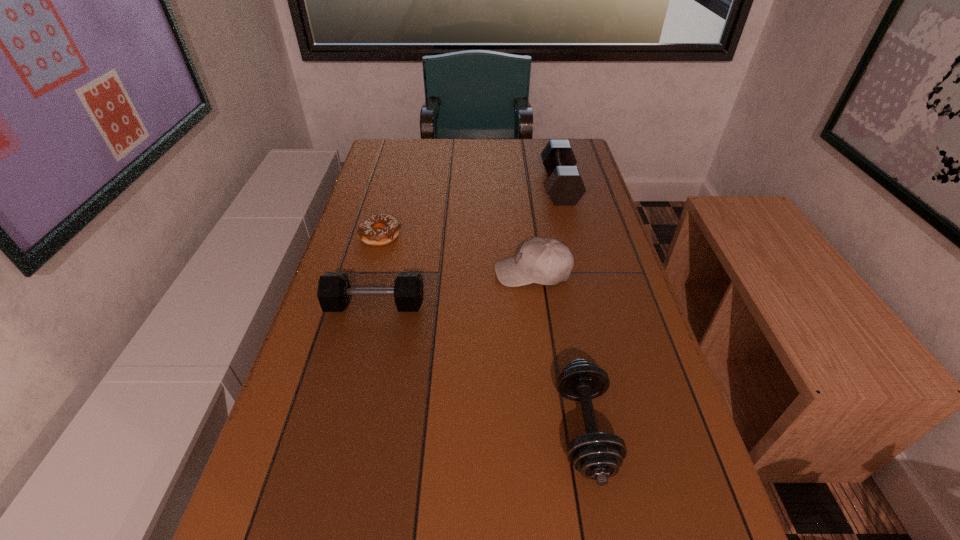
The height and width of the screenshot is (540, 960). Find the location of `blank space at the left edge`. blank space at the left edge is located at coordinates (376, 200).

I want to click on free space at the right edge of the desktop, so click(x=579, y=295).

Locate an element on the screen. Image resolution: width=960 pixels, height=540 pixels. vacant space at the far left corner of the desktop is located at coordinates (387, 146).

Find the location of a particular element. The height and width of the screenshot is (540, 960). vacant point located between the fourth nearest object and the leftmost dumbbell is located at coordinates pyautogui.click(x=378, y=271).

This screenshot has width=960, height=540. Identify the location of free spot between the second farthest object and the nearest object. (483, 333).

Where is `free area in between the farthest dumbbell and the shortest object`? This screenshot has width=960, height=540. free area in between the farthest dumbbell and the shortest object is located at coordinates (470, 211).

Find the location of a particular element. The height and width of the screenshot is (540, 960). free space between the farthest dumbbell and the nearest dumbbell is located at coordinates (572, 308).

You are a GUI agent. You are given a task and a screenshot of the screen. Output one action in this format:
    pyautogui.click(x=<x>, y=<y>)
    Task: Click on the empty space between the second nearest object and the nearest dumbbell
    
    Given the screenshot: What is the action you would take?
    480,368

Image resolution: width=960 pixels, height=540 pixels. I want to click on free space between the farthest object and the third nearest object, so click(546, 229).

What are the coordinates of `unoccupied area between the third farthest object and the farthest object` in the screenshot? It's located at (546, 229).